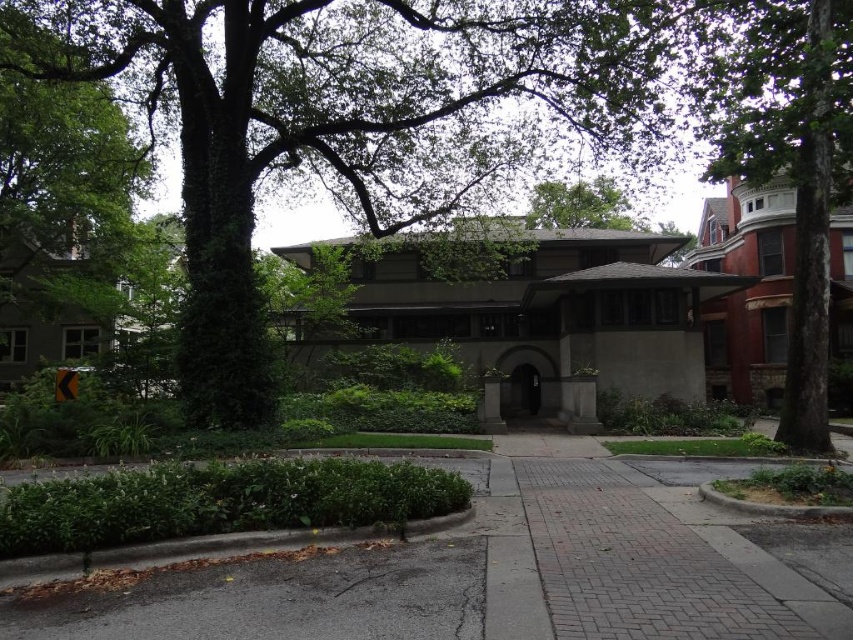
Question: Does green leafy tree at center appear on the left side of brick pavement at center?

Choices:
 (A) yes
 (B) no

Answer: (B)

Question: Which object is farther from the camera taking this photo?

Choices:
 (A) brick paved sidewalk at center
 (B) brick pavement at center
 (C) green leafy tree at center

Answer: (C)

Question: Which point is farther to the camera?

Choices:
 (A) green leafy tree at upper center
 (B) brick pavement at center
 (C) brick paved sidewalk at center
 (D) green leafy tree at center

Answer: (A)

Question: Can you confirm if green leafy tree at center is positioned to the right of green leafy tree at upper center?

Choices:
 (A) yes
 (B) no

Answer: (B)

Question: Which point is closer to the camera?

Choices:
 (A) (561, 200)
 (B) (703, 536)

Answer: (B)

Question: Is green leafy tree at center in front of brick pavement at center?

Choices:
 (A) yes
 (B) no

Answer: (B)